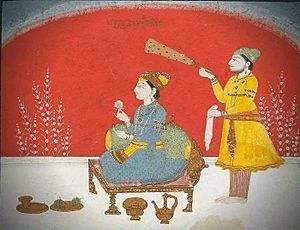
The image size is (300, 230). In order to click on artwork in this screenshot , I will do `click(266, 40)`.